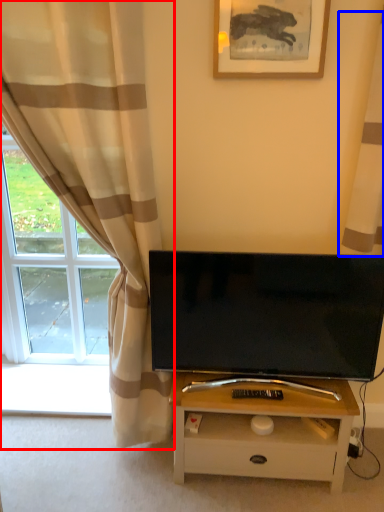
Question: Which object appears closest to the camera in this image, curtain (highlighted by a red box) or curtain (highlighted by a blue box)?

Choices:
 (A) curtain
 (B) curtain

Answer: (A)